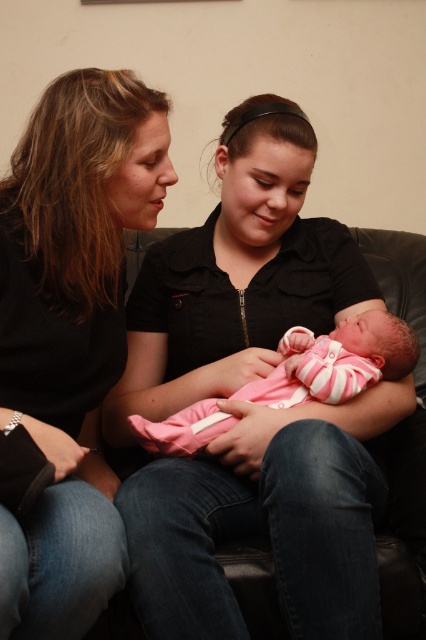
You are a photographer taking a portrait of the matte black shirt at upper left and the pink striped fabric newborn at center. Which object should you focus on first to ensure it appears sharp in the photo?

The matte black shirt at upper left is closer to the viewer than the pink striped fabric newborn at center, so you should focus on the matte black shirt at upper left first to ensure it appears sharp.

You are a photographer trying to capture the baby in the center of the image. There are two babies here, a pink matte fabric baby at center and a pink striped fabric newborn at center. Which one is on the left side so I can adjust my camera accordingly?

The pink matte fabric baby at center is positioned on the left side of the pink striped fabric newborn at center, so you should adjust your camera to focus on the pink matte fabric baby at center to capture the leftmost baby.

In the scene shown: You are designing a layout for a photo album and need to place the pink matte fabric baby at center and the matte black shirt at upper left. Which object should be placed first to ensure proper alignment with the image?

The pink matte fabric baby at center should be placed first because it is wider than the matte black shirt at upper left, ensuring proper alignment with the image.